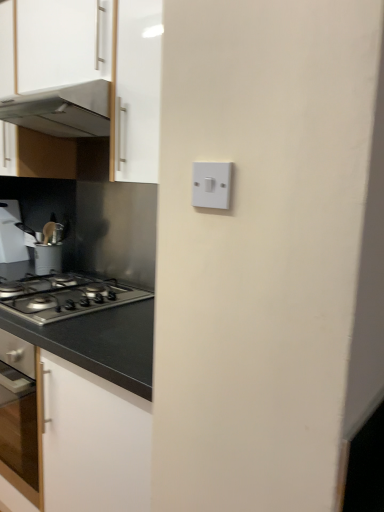
Question: Is white plastic light switch at center not near white glossy cabinet at upper left?

Choices:
 (A) yes
 (B) no

Answer: (B)

Question: Can we say white plastic light switch at center lies outside white glossy cabinet at upper left?

Choices:
 (A) no
 (B) yes

Answer: (B)

Question: From the image's perspective, is white plastic light switch at center located above white glossy cabinet at upper left?

Choices:
 (A) yes
 (B) no

Answer: (B)

Question: Can you confirm if white plastic light switch at center is positioned to the left of white glossy cabinet at upper left?

Choices:
 (A) no
 (B) yes

Answer: (A)

Question: Is white plastic light switch at center to the right of white glossy cabinet at upper left from the viewer's perspective?

Choices:
 (A) no
 (B) yes

Answer: (B)

Question: Does white plastic light switch at center turn towards white glossy cabinet at upper left?

Choices:
 (A) yes
 (B) no

Answer: (B)

Question: Is brushed metal utensil holder at left to the right of satin silver gas stove at lower left from the viewer's perspective?

Choices:
 (A) yes
 (B) no

Answer: (B)

Question: Is brushed metal utensil holder at left to the left of satin silver gas stove at lower left from the viewer's perspective?

Choices:
 (A) no
 (B) yes

Answer: (B)

Question: From a real-world perspective, is brushed metal utensil holder at left physically above satin silver gas stove at lower left?

Choices:
 (A) yes
 (B) no

Answer: (A)

Question: Is the depth of brushed metal utensil holder at left less than that of satin silver gas stove at lower left?

Choices:
 (A) no
 (B) yes

Answer: (A)

Question: Is brushed metal utensil holder at left thinner than satin silver gas stove at lower left?

Choices:
 (A) no
 (B) yes

Answer: (B)

Question: Is brushed metal utensil holder at left positioned with its back to satin silver gas stove at lower left?

Choices:
 (A) no
 (B) yes

Answer: (A)

Question: From a real-world perspective, is metallic stainless steel range hood at upper left over white plastic light switch at center?

Choices:
 (A) yes
 (B) no

Answer: (A)